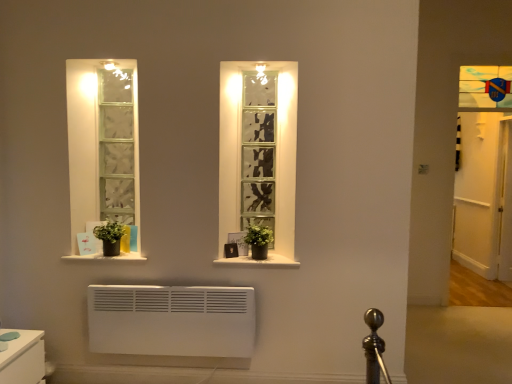
Question: Considering their positions, is green matte plant at center, the 1th plant positioned from the right, located in front of or behind white matte window sill at lower left, which ranks as the 2th window sill in right-to-left order?

Choices:
 (A) behind
 (B) front

Answer: (B)

Question: Looking at the image, does green matte plant at center, the 1th plant positioned from the right, seem bigger or smaller compared to white matte window sill at lower left, which ranks as the 2th window sill in right-to-left order?

Choices:
 (A) small
 (B) big

Answer: (A)

Question: Which object is the closest to the white glossy door at right?

Choices:
 (A) white wooden door at right
 (B) black matte window sill at center, arranged as the second window sill when viewed from the left
 (C) white matte window sill at lower left, which is the first window sill in left-to-right order
 (D) green matte plant at center, marked as the 2th plant in a left-to-right arrangement
 (E) green matte plant at lower left, which ranks as the first plant in left-to-right order

Answer: (A)

Question: Estimate the real-world distances between objects in this image. Which object is farther from the white matte window sill at lower left, which is the first window sill in left-to-right order?

Choices:
 (A) green matte plant at lower left, positioned as the 2th plant in right-to-left order
 (B) black matte window sill at center, the 1th window sill when ordered from right to left
 (C) white wooden door at right
 (D) green matte plant at center, the 1th plant positioned from the right
 (E) white glossy door at right

Answer: (E)